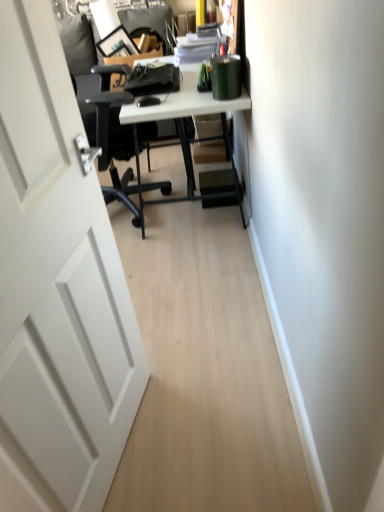
Question: Should I look upward or downward to see white glossy desk at center?

Choices:
 (A) up
 (B) down

Answer: (A)

Question: From the image's perspective, is white matte door at left above white glossy desk at center?

Choices:
 (A) yes
 (B) no

Answer: (B)

Question: Can you confirm if white matte door at left is bigger than white glossy desk at center?

Choices:
 (A) no
 (B) yes

Answer: (A)

Question: Considering the relative sizes of white matte door at left and white glossy desk at center in the image provided, is white matte door at left taller than white glossy desk at center?

Choices:
 (A) no
 (B) yes

Answer: (B)

Question: Can you confirm if white matte door at left is wider than white glossy desk at center?

Choices:
 (A) no
 (B) yes

Answer: (A)

Question: Is white matte door at left oriented away from white glossy desk at center?

Choices:
 (A) yes
 (B) no

Answer: (B)

Question: From a real-world perspective, is white matte door at left on top of white glossy desk at center?

Choices:
 (A) yes
 (B) no

Answer: (A)

Question: Is white glossy desk at center thinner than white matte door at left?

Choices:
 (A) yes
 (B) no

Answer: (B)

Question: Is white glossy desk at center surrounding white matte door at left?

Choices:
 (A) no
 (B) yes

Answer: (A)

Question: From the image's perspective, does white glossy desk at center appear higher than white matte door at left?

Choices:
 (A) yes
 (B) no

Answer: (A)

Question: Is white glossy desk at center looking in the opposite direction of white matte door at left?

Choices:
 (A) no
 (B) yes

Answer: (A)

Question: Is the position of white glossy desk at center more distant than that of white matte door at left?

Choices:
 (A) yes
 (B) no

Answer: (A)

Question: Is white glossy desk at center wider than white matte door at left?

Choices:
 (A) yes
 (B) no

Answer: (A)

Question: Considering their positions, is white glossy desk at center located in front of or behind white matte door at left?

Choices:
 (A) front
 (B) behind

Answer: (B)